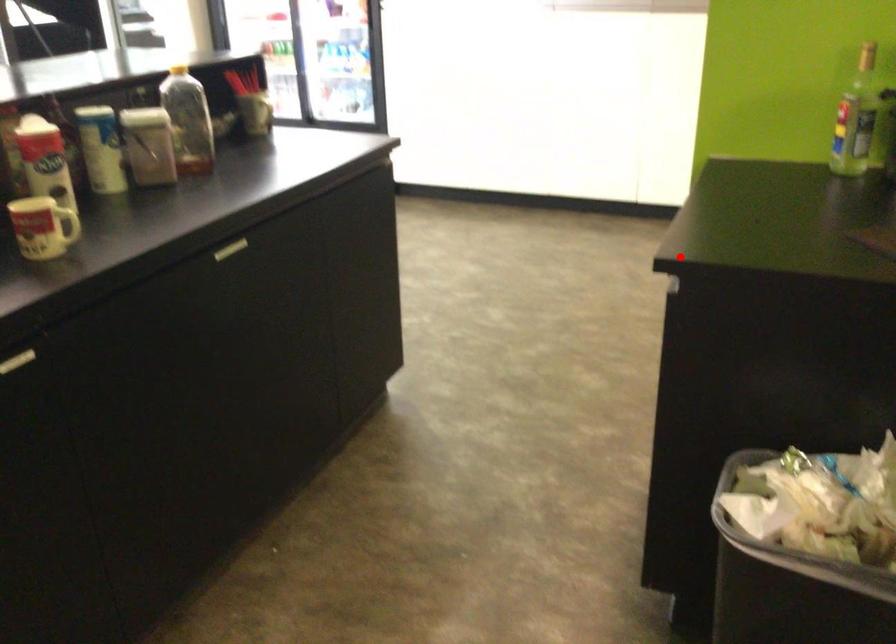
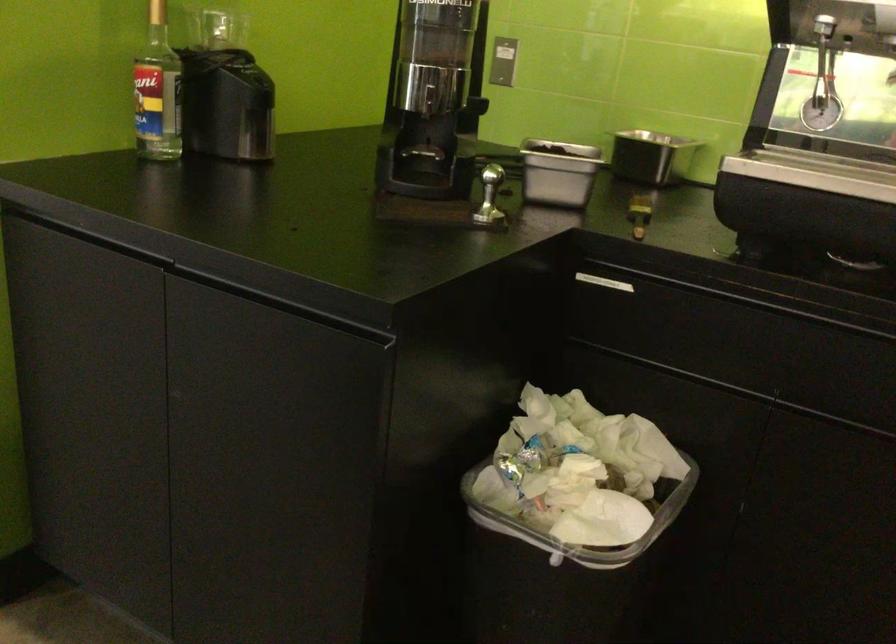
Question: I am providing you with two images of the same scene from different viewpoints. In image1, a red point is highlighted. Considering the same 3D point in image2, which of the following is correct?

Choices:
 (A) It is closer
 (B) It is farther

Answer: (A)